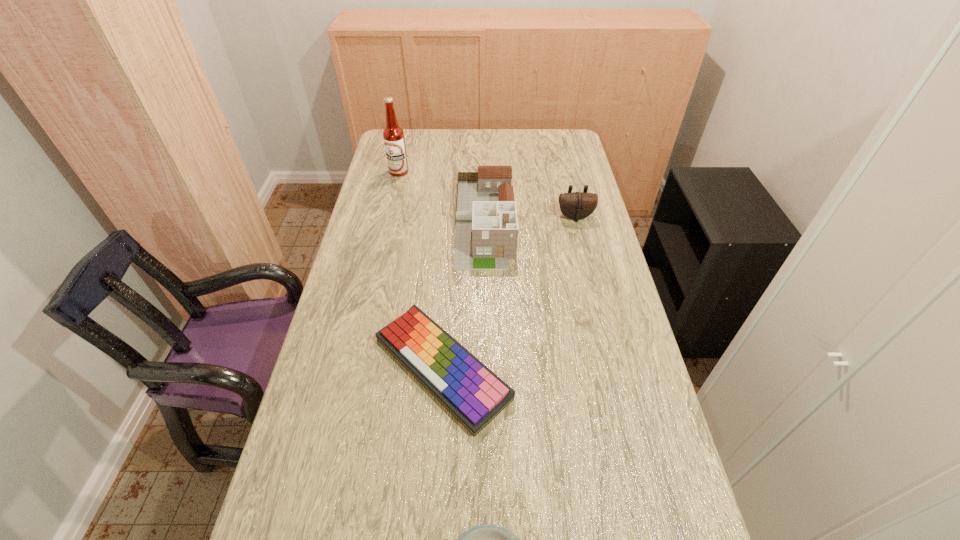
Identify the location of the tallest object. This screenshot has width=960, height=540. (393, 135).

The height and width of the screenshot is (540, 960). Identify the location of the leftmost object. (393, 135).

At what (x,y) coordinates should I click in order to perform the action: click on the second tallest object. Please return your answer as a coordinate pair (x, y). This screenshot has width=960, height=540. Looking at the image, I should click on (486, 235).

The image size is (960, 540). I want to click on the third tallest object, so click(574, 205).

I want to click on the rightmost object, so click(x=574, y=205).

Where is `the shortest object`? the shortest object is located at coordinates (470, 391).

The image size is (960, 540). I want to click on computer keyboard, so (470, 391).

Where is `free spot located 0.400m on the label side of the leftmost object`? Image resolution: width=960 pixels, height=540 pixels. free spot located 0.400m on the label side of the leftmost object is located at coordinates (382, 246).

In order to click on vacant space positioned at the main entrance of the dollhouse in this screenshot , I will do `click(486, 326)`.

Locate an element on the screen. Image resolution: width=960 pixels, height=540 pixels. vacant region located with the flap open on the third tallest object is located at coordinates (581, 240).